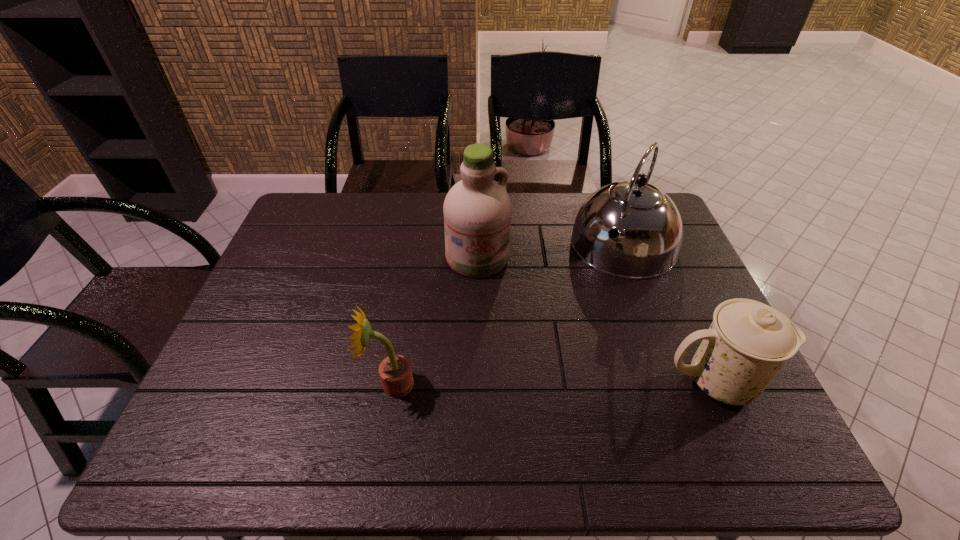
The width and height of the screenshot is (960, 540). In the image, there is a desktop. What are the coordinates of `vacant space at the far edge` in the screenshot? It's located at 573,192.

The width and height of the screenshot is (960, 540). Find the location of `vacant space at the near edge of the desktop`. vacant space at the near edge of the desktop is located at coordinates (451, 414).

Find the location of a particular element. free space at the left edge is located at coordinates (319, 255).

Where is `free space at the far left corner of the desktop`? The width and height of the screenshot is (960, 540). free space at the far left corner of the desktop is located at coordinates (305, 231).

Identify the location of blank region between the sunflower and the cleansing agent. This screenshot has width=960, height=540. pos(434,321).

Identify the location of free space between the sunflower and the kettle. (508, 314).

The height and width of the screenshot is (540, 960). Find the location of `free space between the chinaware and the kettle`. free space between the chinaware and the kettle is located at coordinates (669, 313).

This screenshot has height=540, width=960. I want to click on empty space between the leftmost object and the cleansing agent, so click(x=434, y=321).

Find the location of a particular element. The width and height of the screenshot is (960, 540). empty space between the kettle and the cleansing agent is located at coordinates (550, 251).

The width and height of the screenshot is (960, 540). Identify the location of vacant space that's between the third object from right to left and the kettle. (550, 251).